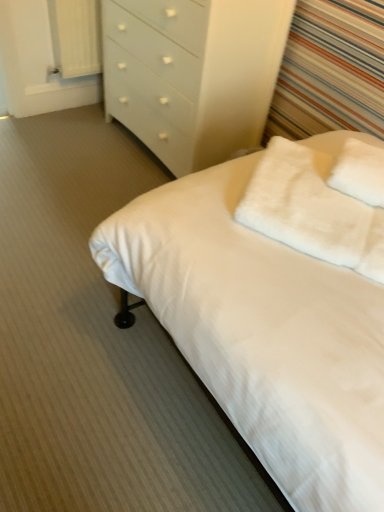
Question: From the image's perspective, is white fabric curtain at upper left positioned above or below white fluffy pillow at upper right, which appears as the second pillow when viewed from the right?

Choices:
 (A) below
 (B) above

Answer: (B)

Question: Is white fabric curtain at upper left taller or shorter than white fluffy pillow at upper right, which appears as the second pillow when viewed from the right?

Choices:
 (A) short
 (B) tall

Answer: (B)

Question: Estimate the real-world distances between objects in this image. Which object is closer to the white glossy chest of drawers at upper center?

Choices:
 (A) white soft bed at center
 (B) white fluffy pillow at upper right, which appears as the second pillow when viewed from the right
 (C) white fluffy pillow at upper right, marked as the first pillow in a right-to-left arrangement
 (D) white fabric curtain at upper left

Answer: (D)

Question: Which object is the closest to the white soft bed at center?

Choices:
 (A) white fluffy pillow at upper right, marked as the 1th pillow in a left-to-right arrangement
 (B) white fabric curtain at upper left
 (C) white glossy chest of drawers at upper center
 (D) white fluffy pillow at upper right, marked as the first pillow in a right-to-left arrangement

Answer: (A)